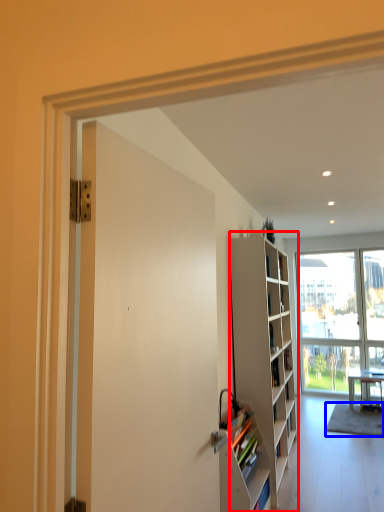
Question: Which of the following is the farthest to the observer, cabinetry (highlighted by a red box) or carpets (highlighted by a blue box)?

Choices:
 (A) cabinetry
 (B) carpets

Answer: (B)